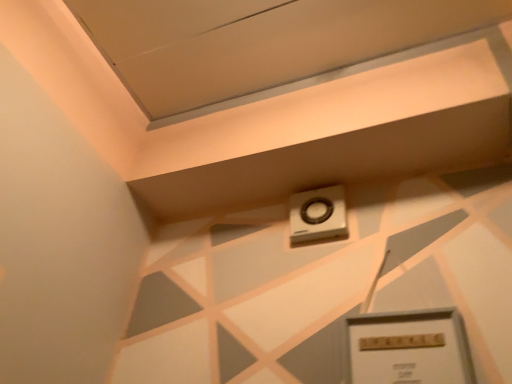
Image resolution: width=512 pixels, height=384 pixels. What do you see at coordinates (318, 214) in the screenshot? I see `white plastic alarm at upper center` at bounding box center [318, 214].

Find the location of `white plastic alarm at upper center`. white plastic alarm at upper center is located at coordinates (318, 214).

Where is `metallic gray thermostat at upper center`? Image resolution: width=512 pixels, height=384 pixels. metallic gray thermostat at upper center is located at coordinates (408, 348).

What is the approximate height of metallic gray thermostat at upper center?

10.68 inches.

Image resolution: width=512 pixels, height=384 pixels. Describe the element at coordinates (408, 348) in the screenshot. I see `metallic gray thermostat at upper center` at that location.

The height and width of the screenshot is (384, 512). I want to click on white plastic alarm at upper center, so click(318, 214).

Considering the relative positions of metallic gray thermostat at upper center and white plastic alarm at upper center in the image provided, is metallic gray thermostat at upper center to the left of white plastic alarm at upper center from the viewer's perspective?

No, metallic gray thermostat at upper center is not to the left of white plastic alarm at upper center.

Considering the positions of objects metallic gray thermostat at upper center and white plastic alarm at upper center in the image provided, who is behind, metallic gray thermostat at upper center or white plastic alarm at upper center?

white plastic alarm at upper center is more distant.

Which point is more forward, [421,350] or [325,236]?

The point [421,350] is closer.

Consider the image. From the image's perspective, which one is positioned lower, metallic gray thermostat at upper center or white plastic alarm at upper center?

metallic gray thermostat at upper center is shown below in the image.

Based on the photo, from a real-world perspective, is metallic gray thermostat at upper center positioned above or below white plastic alarm at upper center?

From a real-world perspective, metallic gray thermostat at upper center is physically below white plastic alarm at upper center.

Looking at their sizes, would you say metallic gray thermostat at upper center is wider or thinner than white plastic alarm at upper center?

Considering their sizes, metallic gray thermostat at upper center looks slimmer than white plastic alarm at upper center.

Consider the image. Which of these two, metallic gray thermostat at upper center or white plastic alarm at upper center, stands taller?

metallic gray thermostat at upper center is taller.

Considering the sizes of objects metallic gray thermostat at upper center and white plastic alarm at upper center in the image provided, who is bigger, metallic gray thermostat at upper center or white plastic alarm at upper center?

Bigger between the two is metallic gray thermostat at upper center.

Is metallic gray thermostat at upper center not inside white plastic alarm at upper center?

Indeed, metallic gray thermostat at upper center is completely outside white plastic alarm at upper center.

Is metallic gray thermostat at upper center positioned far away from white plastic alarm at upper center?

Actually, metallic gray thermostat at upper center and white plastic alarm at upper center are a little close together.

Is metallic gray thermostat at upper center facing away from white plastic alarm at upper center?

No.

How different are the orientations of metallic gray thermostat at upper center and white plastic alarm at upper center in degrees?

0.0348 degrees.

This screenshot has height=384, width=512. Identify the location of alarm located behind the metallic gray thermostat at upper center. (318, 214).

Which object is positioned more to the left, white plastic alarm at upper center or metallic gray thermostat at upper center?

From the viewer's perspective, white plastic alarm at upper center appears more on the left side.

Does white plastic alarm at upper center come in front of metallic gray thermostat at upper center?

No.

Which is closer, (294, 226) or (399, 381)?

Clearly, point (294, 226) is more distant from the camera than point (399, 381).

From the image's perspective, is white plastic alarm at upper center below metallic gray thermostat at upper center?

Actually, white plastic alarm at upper center appears above metallic gray thermostat at upper center in the image.

From a real-world perspective, is white plastic alarm at upper center under metallic gray thermostat at upper center?

Actually, white plastic alarm at upper center is physically above metallic gray thermostat at upper center in the real world.

Which of these two, white plastic alarm at upper center or metallic gray thermostat at upper center, is wider?

white plastic alarm at upper center.

Considering the sizes of objects white plastic alarm at upper center and metallic gray thermostat at upper center in the image provided, who is shorter, white plastic alarm at upper center or metallic gray thermostat at upper center?

With less height is white plastic alarm at upper center.

Can you confirm if white plastic alarm at upper center is bigger than metallic gray thermostat at upper center?

No, white plastic alarm at upper center is not bigger than metallic gray thermostat at upper center.

From the picture: Could metallic gray thermostat at upper center be considered to be inside white plastic alarm at upper center?

No, metallic gray thermostat at upper center is not inside white plastic alarm at upper center.

Are white plastic alarm at upper center and metallic gray thermostat at upper center located far from each other?

No, white plastic alarm at upper center is not far away from metallic gray thermostat at upper center.

Is metallic gray thermostat at upper center at the back of white plastic alarm at upper center?

white plastic alarm at upper center is not turned away from metallic gray thermostat at upper center.

Find the location of `alarm above the metallic gray thermostat at upper center (from the image's perspective)`. alarm above the metallic gray thermostat at upper center (from the image's perspective) is located at coordinates (318, 214).

This screenshot has height=384, width=512. I want to click on alarm on the left of metallic gray thermostat at upper center, so click(x=318, y=214).

The image size is (512, 384). I want to click on rectangle below the white plastic alarm at upper center (from a real-world perspective), so click(408, 348).